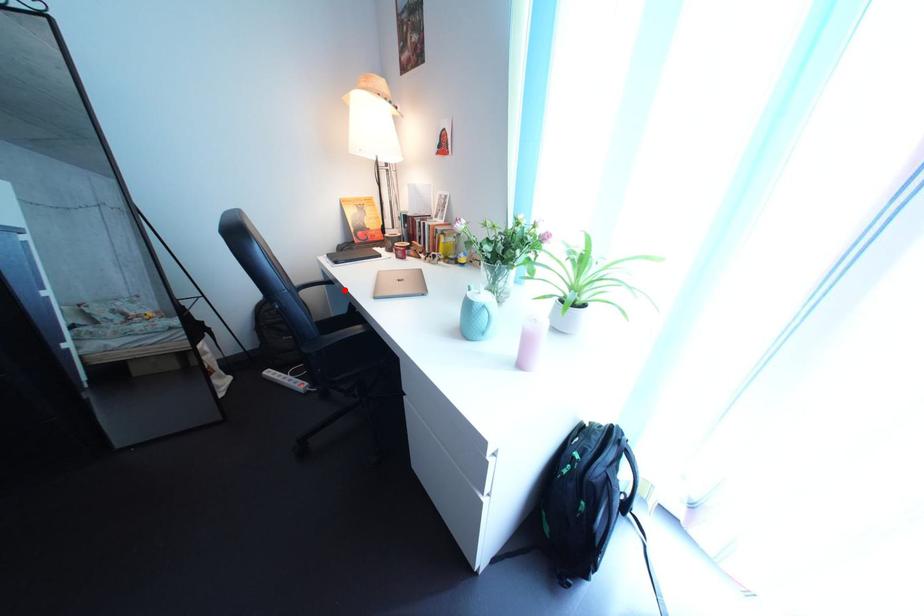
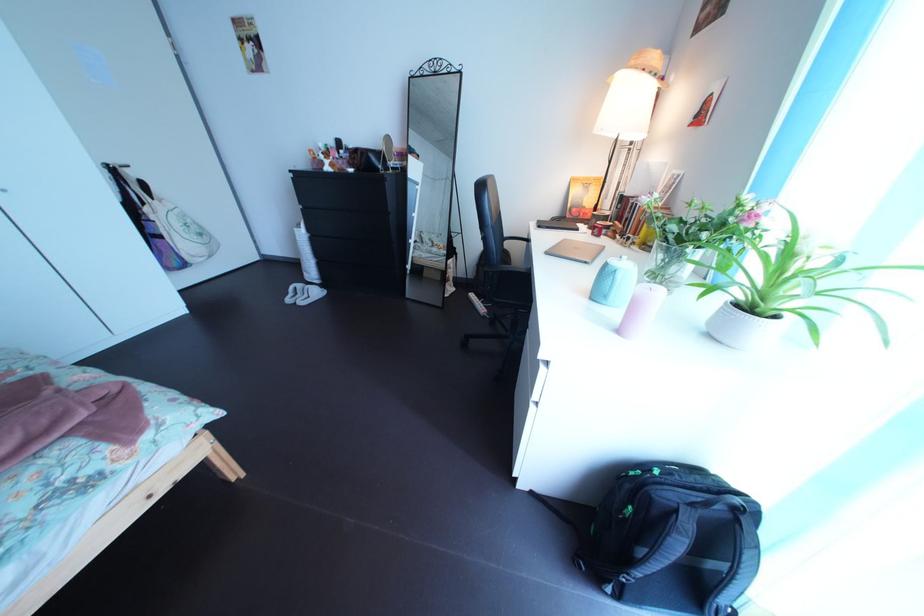
Where in the second image is the point corresponding to the highlighted location from the first image?

(541, 248)